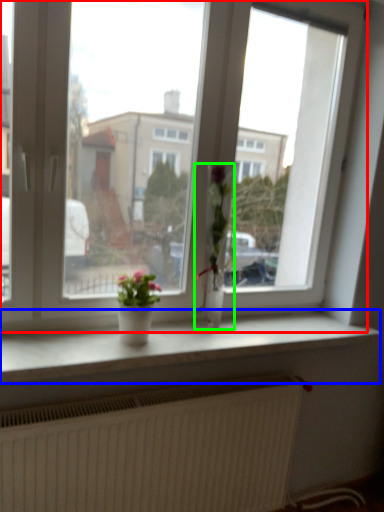
Question: Based on their relative distances, which object is nearer to window (highlighted by a red box)? Choose from window sill (highlighted by a blue box) and houseplant (highlighted by a green box).

Choices:
 (A) window sill
 (B) houseplant

Answer: (B)